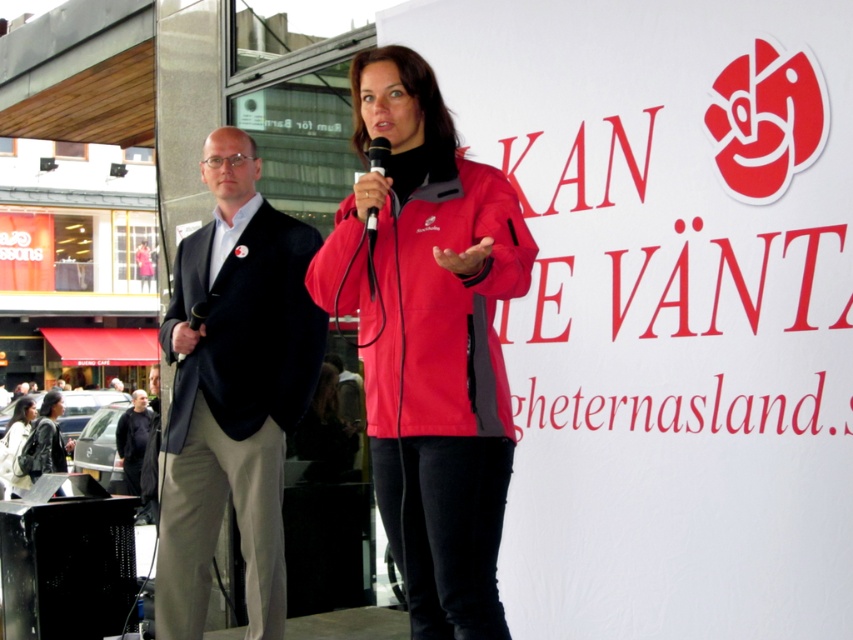
You are a photographer at the event and want to capture a photo of both the matte black suit at left and the red softshell jacket at center. Which person should you focus on first to ensure both are in the frame?

The matte black suit at left is positioned on the left side of the red softshell jacket at center, so you should focus on the matte black suit at left first to ensure both are in the frame.

You are an event photographer positioned at the back of the stage. You need to capture a photo of both the black woolen jacket at left and the black matte jacket at center without any overlap. Given their positions, which jacket should you focus on first to ensure both are visible in the frame?

The black woolen jacket at left is to the right of the black matte jacket at center, so you should focus on the black matte jacket at center first and then pan slightly to the right to include the black woolen jacket at left in the frame.